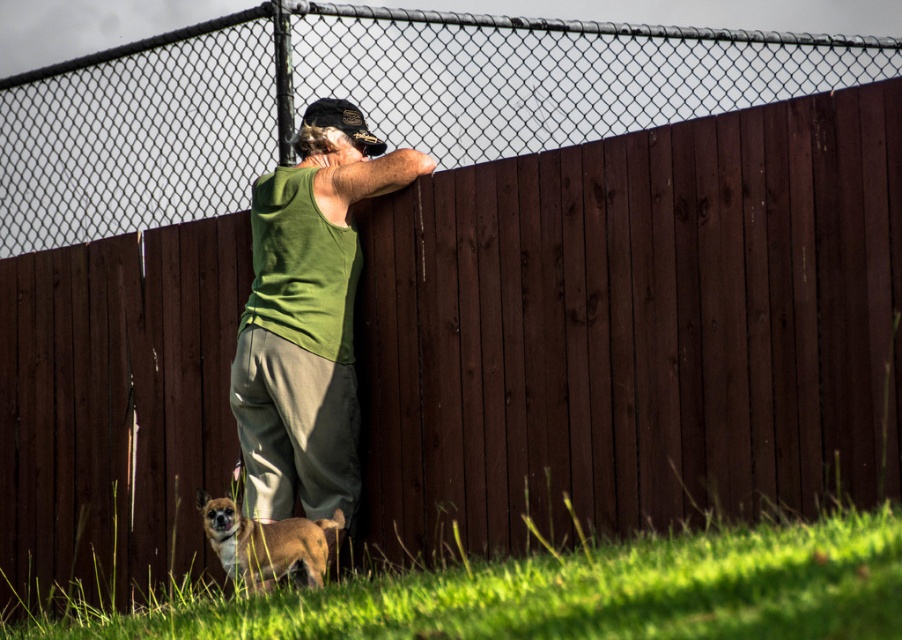
Does green fabric shirt at center have a lesser height compared to brown fur dog at lower left?

No.

Who is shorter, green fabric shirt at center or brown fur dog at lower left?

brown fur dog at lower left

Is point (237, 410) positioned behind point (272, 532)?

Yes, it is behind point (272, 532).

Where is `green fabric shirt at center`? Image resolution: width=902 pixels, height=640 pixels. green fabric shirt at center is located at coordinates (308, 316).